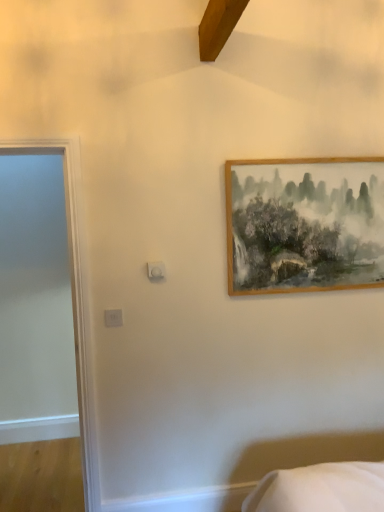
Question: Is wooden frame at upper right spatially inside white glossy door at left, or outside of it?

Choices:
 (A) inside
 (B) outside

Answer: (B)

Question: Is wooden frame at upper right taller or shorter than white glossy door at left?

Choices:
 (A) short
 (B) tall

Answer: (A)

Question: In terms of width, does wooden frame at upper right look wider or thinner when compared to white glossy door at left?

Choices:
 (A) wide
 (B) thin

Answer: (B)

Question: Do you think white glossy door at left is within wooden frame at upper right, or outside of it?

Choices:
 (A) inside
 (B) outside

Answer: (B)

Question: In terms of size, does white glossy door at left appear bigger or smaller than wooden frame at upper right?

Choices:
 (A) big
 (B) small

Answer: (A)

Question: Is white glossy door at left in front of or behind wooden frame at upper right in the image?

Choices:
 (A) front
 (B) behind

Answer: (A)

Question: From a real-world perspective, is white glossy door at left above or below wooden frame at upper right?

Choices:
 (A) below
 (B) above

Answer: (A)